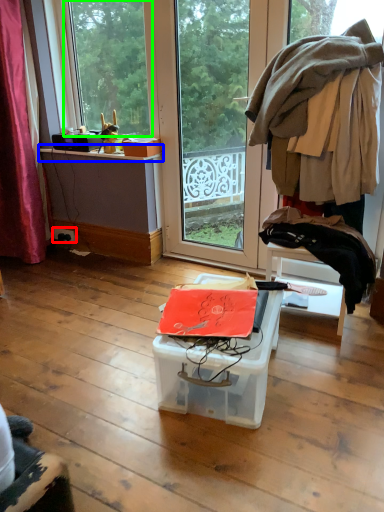
Question: Based on their relative distances, which object is farther from power outlet (highlighted by a red box)? Choose from window sill (highlighted by a blue box) and window (highlighted by a green box).

Choices:
 (A) window sill
 (B) window

Answer: (B)